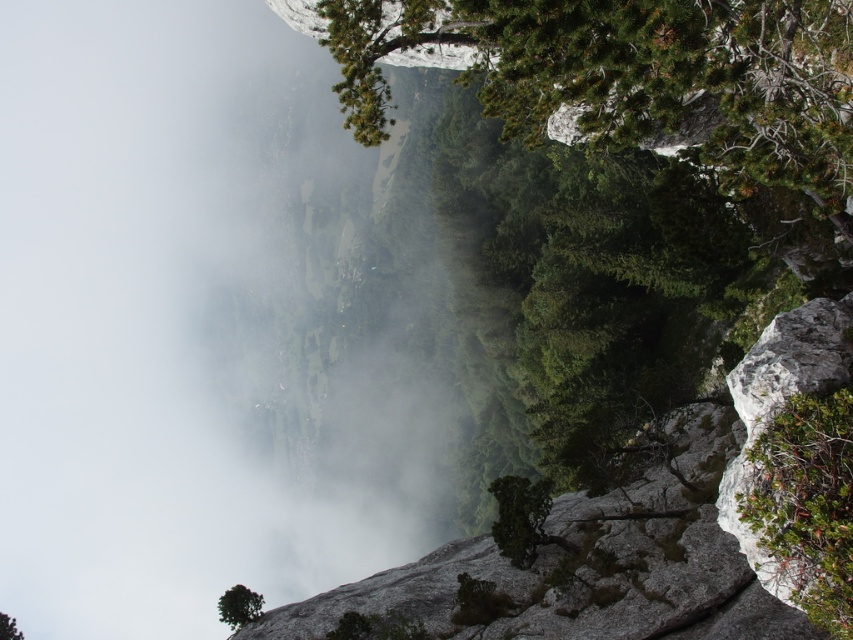
Question: Which point is farther to the camera?

Choices:
 (A) green leafy tree at upper center
 (B) green rough bark tree at center
 (C) green textured tree at upper right
 (D) green leafy shrub at right

Answer: (B)

Question: Estimate the real-world distances between objects in this image. Which object is farther from the green leafy tree at upper center?

Choices:
 (A) green leafy shrub at right
 (B) green matte tree at lower left

Answer: (A)

Question: Is white misty fog at upper left bigger than green textured tree at upper right?

Choices:
 (A) no
 (B) yes

Answer: (B)

Question: Which object appears farthest from the camera in this image?

Choices:
 (A) green leafy tree at upper center
 (B) green textured tree at upper right
 (C) green leafy shrub at right
 (D) green matte tree at lower left

Answer: (D)

Question: Does green textured tree at upper right come behind green matte tree at lower left?

Choices:
 (A) no
 (B) yes

Answer: (A)

Question: Is white misty fog at upper left above green textured tree at upper right?

Choices:
 (A) yes
 (B) no

Answer: (B)